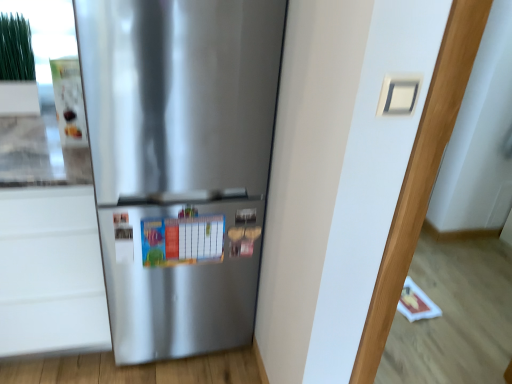
Identify the location of white matte drawer at lower left. This screenshot has height=384, width=512. (51, 272).

Describe the element at coordinates (180, 164) in the screenshot. The width and height of the screenshot is (512, 384). I see `satin silver refrigerator at center` at that location.

The width and height of the screenshot is (512, 384). Identify the location of white matte drawer at lower left. (51, 272).

Do you think white matte drawer at lower left is within satin silver refrigerator at center, or outside of it?

white matte drawer at lower left is spatially situated outside satin silver refrigerator at center.

Does white matte drawer at lower left have a smaller size compared to satin silver refrigerator at center?

Indeed, white matte drawer at lower left has a smaller size compared to satin silver refrigerator at center.

Which is in front, white matte drawer at lower left or satin silver refrigerator at center?

satin silver refrigerator at center is more forward.

From the picture: How many degrees apart are the facing directions of white matte door at center and white matte drawer at lower left?

white matte door at center and white matte drawer at lower left are facing 0.0356 degrees away from each other.

From the image's perspective, is white matte door at center above white matte drawer at lower left?

No, from the image's perspective, white matte door at center is not over white matte drawer at lower left.

Is white matte door at center closer to the viewer compared to white matte drawer at lower left?

Yes.

Is point (332, 357) positioned behind point (48, 309)?

No, (332, 357) is in front of (48, 309).

From the image's perspective, is satin silver refrigerator at center on top of white matte drawer at lower left?

Yes, from the image's perspective, satin silver refrigerator at center is on top of white matte drawer at lower left.

Can you tell me how much satin silver refrigerator at center and white matte drawer at lower left differ in facing direction?

The angular difference between satin silver refrigerator at center and white matte drawer at lower left is 0.000532 degrees.

In the scene shown: Is satin silver refrigerator at center at the left side of white matte drawer at lower left?

No.

Considering the positions of objects white matte drawer at lower left and white matte door at center in the image provided, who is more to the right, white matte drawer at lower left or white matte door at center?

From the viewer's perspective, white matte door at center appears more on the right side.

Is the position of white matte drawer at lower left more distant than that of white matte door at center?

That is True.

Could you tell me if white matte drawer at lower left is facing white matte door at center?

No, white matte drawer at lower left is not oriented towards white matte door at center.

Considering the relative sizes of white matte drawer at lower left and white matte door at center in the image provided, is white matte drawer at lower left wider than white matte door at center?

Indeed, white matte drawer at lower left has a greater width compared to white matte door at center.

How different are the orientations of satin silver refrigerator at center and white matte door at center in degrees?

The angle between the facing direction of satin silver refrigerator at center and the facing direction of white matte door at center is 0.0355 degrees.

Could you tell me if satin silver refrigerator at center is turned towards white matte door at center?

No.

Between satin silver refrigerator at center and white matte door at center, which one has more height?

Standing taller between the two is white matte door at center.

Are satin silver refrigerator at center and white matte door at center far apart?

No, satin silver refrigerator at center is in close proximity to white matte door at center.

Locate an element on the screen. This screenshot has height=384, width=512. refrigerator below the white matte door at center (from a real-world perspective) is located at coordinates (180, 164).

Which object is closer to the camera taking this photo, white matte door at center or satin silver refrigerator at center?

white matte door at center.

In terms of size, does white matte door at center appear bigger or smaller than satin silver refrigerator at center?

In the image, white matte door at center appears to be smaller than satin silver refrigerator at center.

Is white matte door at center oriented towards satin silver refrigerator at center?

No, white matte door at center is not oriented towards satin silver refrigerator at center.

Identify the location of refrigerator in front of the white matte drawer at lower left. (180, 164).

Where is `door below the white matte drawer at lower left (from the image's perspective)`? Image resolution: width=512 pixels, height=384 pixels. door below the white matte drawer at lower left (from the image's perspective) is located at coordinates (371, 179).

Estimate the real-world distances between objects in this image. Which object is further from white matte drawer at lower left, satin silver refrigerator at center or white matte door at center?

white matte door at center is further to white matte drawer at lower left.

Which object lies nearer to the anchor point white matte drawer at lower left, white matte door at center or satin silver refrigerator at center?

satin silver refrigerator at center lies closer to white matte drawer at lower left than the other object.

Looking at the image, which one is located closer to white matte door at center, white matte drawer at lower left or satin silver refrigerator at center?

satin silver refrigerator at center.

From the picture: From the image, which object appears to be farther from satin silver refrigerator at center, white matte door at center or white matte drawer at lower left?

white matte door at center.

Consider the image. When comparing their distances from white matte door at center, does satin silver refrigerator at center or white matte drawer at lower left seem closer?

satin silver refrigerator at center.

Estimate the real-world distances between objects in this image. Which object is further from satin silver refrigerator at center, white matte drawer at lower left or white matte door at center?

Among the two, white matte door at center is located further to satin silver refrigerator at center.

Locate an element on the screen. This screenshot has height=384, width=512. refrigerator situated between white matte drawer at lower left and white matte door at center from left to right is located at coordinates (180, 164).